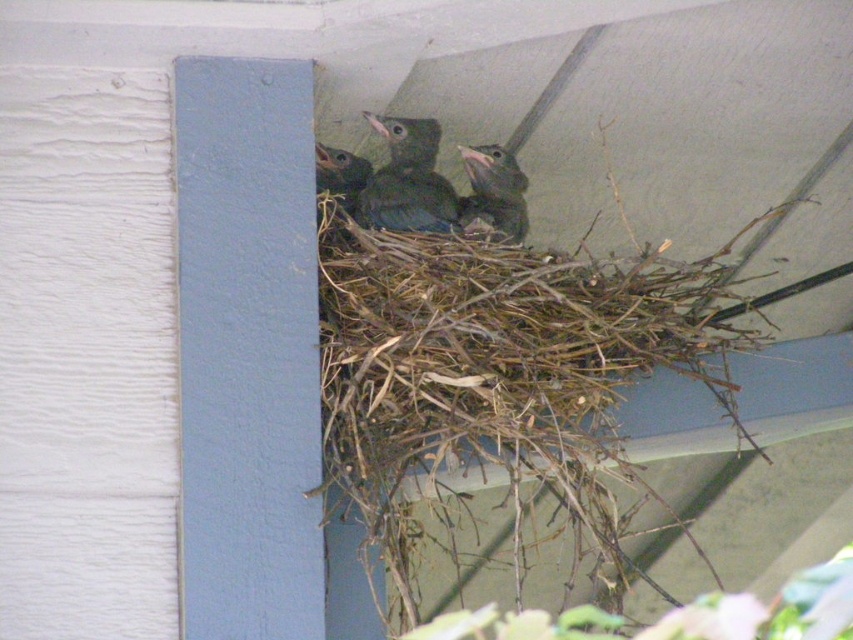
You are a small toy that is 2 inches long. You want to place yourself between the green matte bird at center and the dark green feathers at upper center so that you can be seen by both. Is there enough space for you to fit in between them?

The green matte bird at center and the dark green feathers at upper center are 2.46 inches apart from each other. Since the toy is 2 inches long, there is enough space for it to fit between them as 2.46 inches is greater than 2 inches.